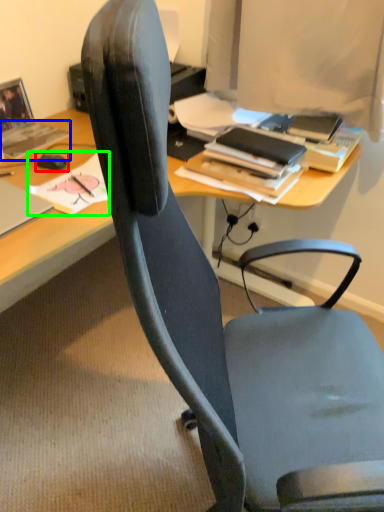
Question: Which object is the closest to the mouse (highlighted by a red box)? Choose among these: book (highlighted by a blue box) or book (highlighted by a green box).

Choices:
 (A) book
 (B) book

Answer: (B)